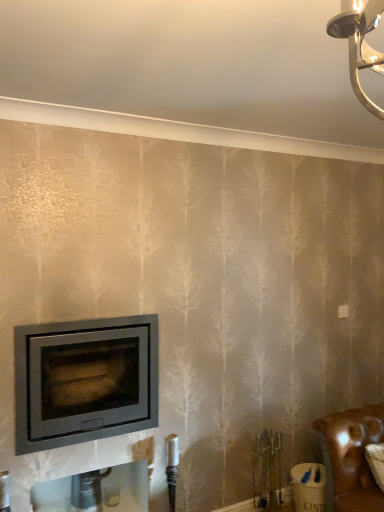
Question: Looking at the image, does brown leather couch at lower right seem bigger or smaller compared to matte gray wood burning stove at lower left?

Choices:
 (A) small
 (B) big

Answer: (A)

Question: Is point (360, 423) positioned closer to the camera than point (109, 398)?

Choices:
 (A) farther
 (B) closer

Answer: (A)

Question: From a real-world perspective, is brown leather couch at lower right above or below matte gray wood burning stove at lower left?

Choices:
 (A) below
 (B) above

Answer: (A)

Question: Which is correct: matte gray wood burning stove at lower left is inside brown leather couch at lower right, or outside of it?

Choices:
 (A) outside
 (B) inside

Answer: (A)

Question: Visually, is matte gray wood burning stove at lower left positioned to the left or to the right of brown leather couch at lower right?

Choices:
 (A) left
 (B) right

Answer: (A)

Question: Considering the positions of point pos(41,385) and point pos(370,417), is point pos(41,385) closer or farther from the camera than point pos(370,417)?

Choices:
 (A) farther
 (B) closer

Answer: (B)

Question: Considering the positions of matte gray wood burning stove at lower left and brown leather couch at lower right in the image, is matte gray wood burning stove at lower left taller or shorter than brown leather couch at lower right?

Choices:
 (A) short
 (B) tall

Answer: (B)